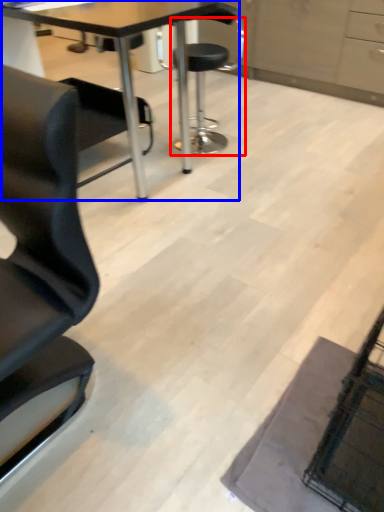
Question: Which point is closer to the camera, chair (highlighted by a red box) or table (highlighted by a blue box)?

Choices:
 (A) chair
 (B) table

Answer: (B)